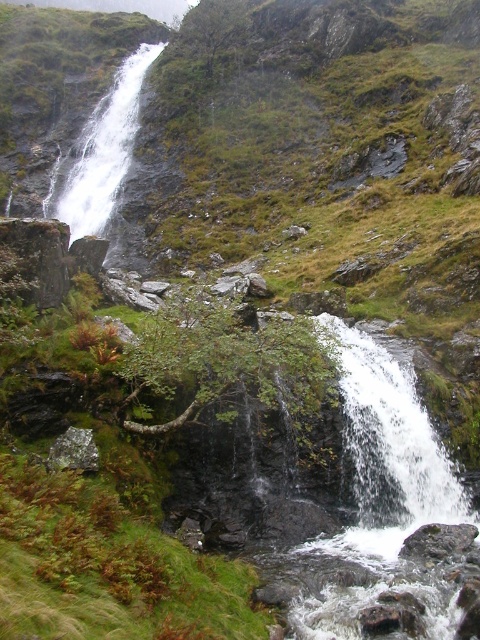
You are standing at the base of the cliffs and want to reach the gray rough rock at lower right. Which direction should you move to get closer to it without passing the white frothy water at center?

You should move to the right and downward because the gray rough rock at lower right is behind the white frothy water at center, so moving right and down will avoid going past the white frothy water at center and get closer to the gray rough rock at lower right.

You are a hiker standing at the base of the cliffs looking up. You see the white frothy water at center and the gray rough rock at lower right. Which object is higher up on the cliff?

The gray rough rock at lower right is higher up on the cliff than the white frothy water at center because the white frothy water at center is located below it.